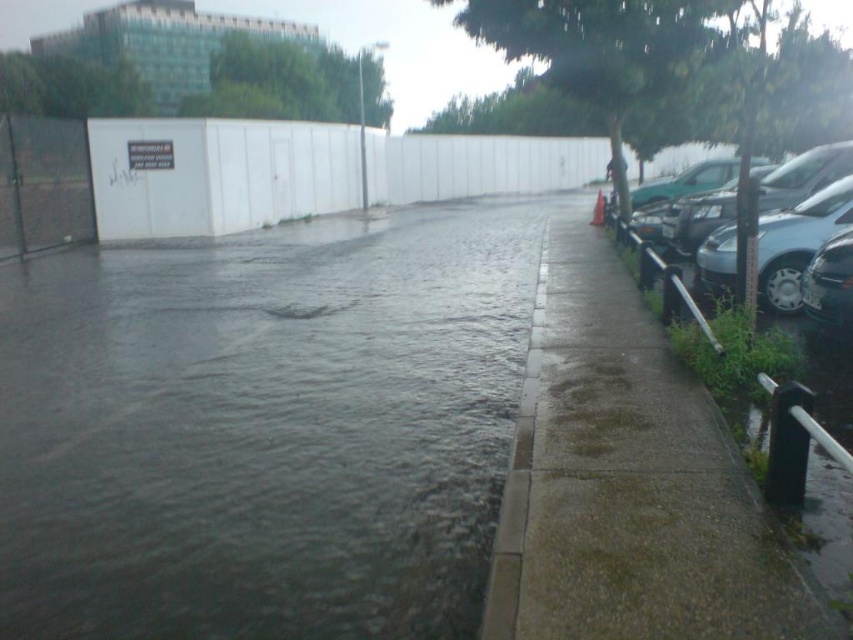
Is point (463, 624) positioned in front of point (817, 276)?

That is True.

Can you confirm if dark wet pavement at center is taller than shiny black car at right?

Correct, dark wet pavement at center is much taller as shiny black car at right.

Where is `dark wet pavement at center`? dark wet pavement at center is located at coordinates [262, 429].

The height and width of the screenshot is (640, 853). In order to click on dark wet pavement at center in this screenshot , I will do `click(262, 429)`.

Who is lower down, gray concrete curb at center or green matte car at right?

gray concrete curb at center is lower down.

Between gray concrete curb at center and green matte car at right, which one appears on the right side from the viewer's perspective?

green matte car at right

Is point (515, 456) in front of point (634, 205)?

Yes, point (515, 456) is closer to viewer.

Locate an element on the screen. gray concrete curb at center is located at coordinates [x=515, y=481].

Between green concrete sidewalk at right and metallic silver car at right, which one is positioned higher?

metallic silver car at right is above.

Can you confirm if green concrete sidewalk at right is bigger than metallic silver car at right?

Indeed, green concrete sidewalk at right has a larger size compared to metallic silver car at right.

Is point (576, 465) positioned after point (790, 193)?

That is False.

At what (x,y) coordinates should I click in order to perform the action: click on green concrete sidewalk at right. Please return your answer as a coordinate pair (x, y). Looking at the image, I should click on (628, 481).